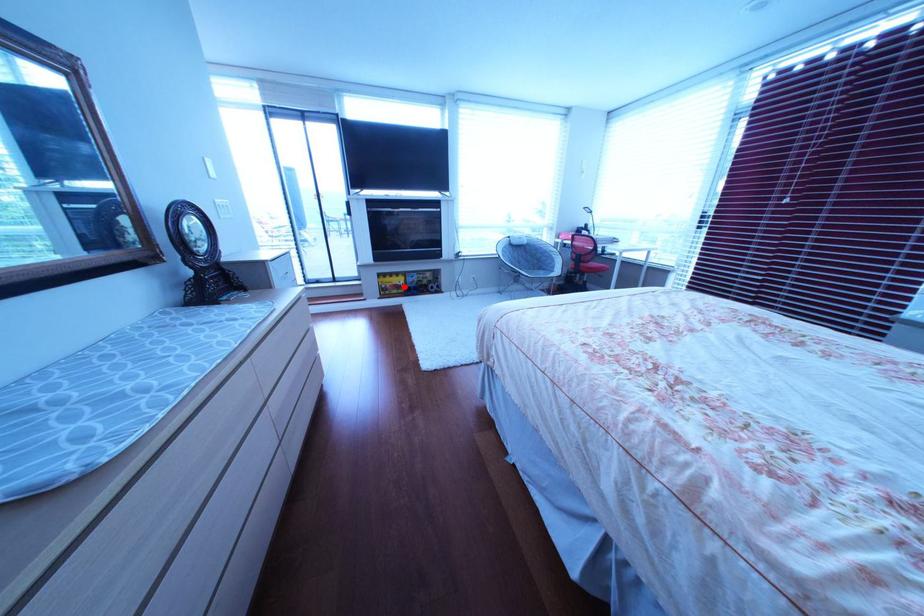
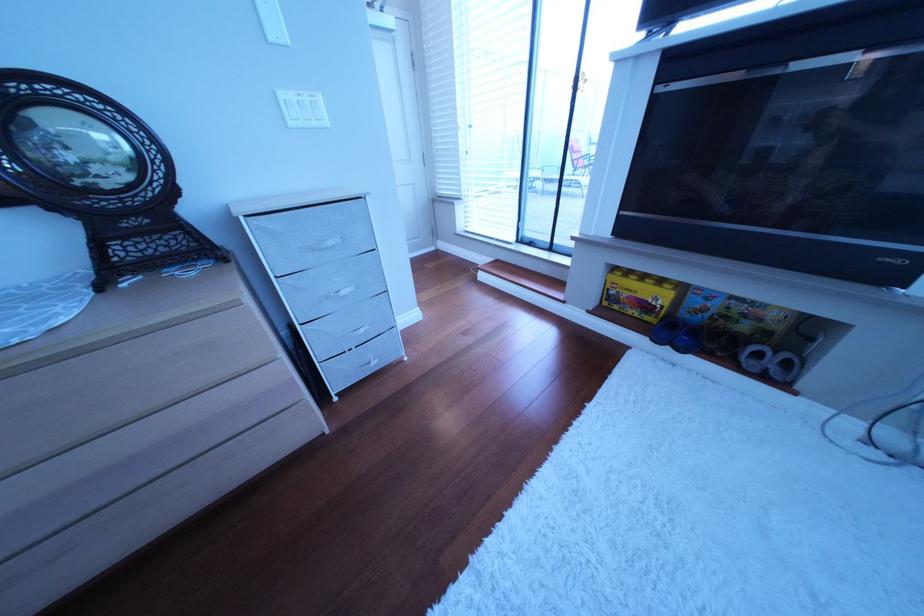
The point at the highlighted location is marked in the first image. Where is the corresponding point in the second image?

(640, 296)